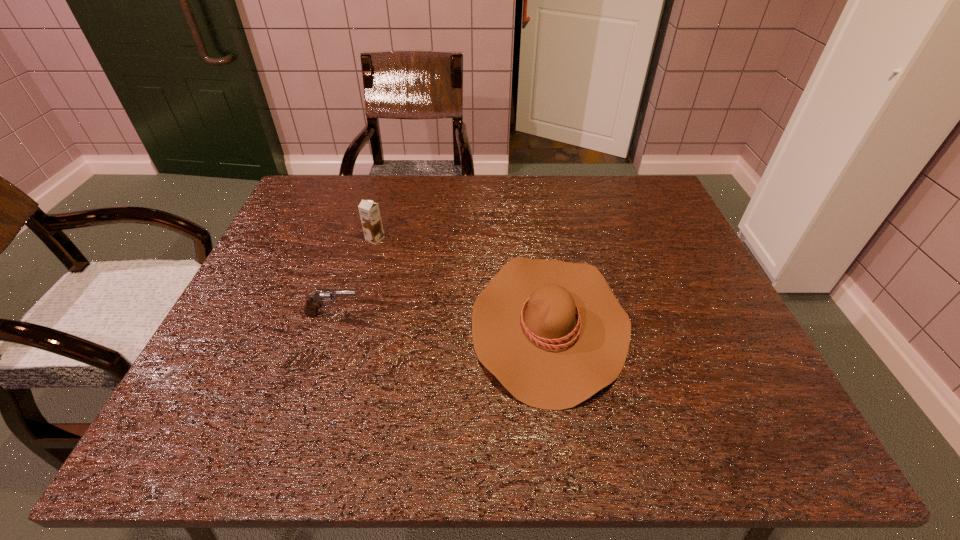
The width and height of the screenshot is (960, 540). Find the location of `vacant point located between the cowboy hat and the farthest object`. vacant point located between the cowboy hat and the farthest object is located at coordinates (462, 281).

This screenshot has height=540, width=960. In order to click on vacant region between the cowboy hat and the pistol in this screenshot , I will do `click(441, 319)`.

This screenshot has width=960, height=540. I want to click on vacant area that lies between the pistol and the cowboy hat, so 441,319.

Identify which object is the second closest to the cowboy hat. Please provide its 2D coordinates. Your answer should be formatted as a tuple, i.e. [(x, y)], where the tuple contains the x and y coordinates of a point satisfying the conditions above.

[(316, 300)]

Identify which object is the closest to the chocolate milk. Please provide its 2D coordinates. Your answer should be formatted as a tuple, i.e. [(x, y)], where the tuple contains the x and y coordinates of a point satisfying the conditions above.

[(316, 300)]

At what (x,y) coordinates should I click in order to perform the action: click on free space that satisfies the following two spatial constraints: 1. on the back side of the cowboy hat; 2. at the barrel of the pistol. Please return your answer as a coordinate pair (x, y). Looking at the image, I should click on (548, 314).

Locate an element on the screen. The width and height of the screenshot is (960, 540). vacant point that satisfies the following two spatial constraints: 1. on the front side of the chocolate milk; 2. on the left side of the rightmost object is located at coordinates (351, 323).

The width and height of the screenshot is (960, 540). In order to click on free space that satisfies the following two spatial constraints: 1. at the barrel of the pistol; 2. on the left side of the cowboy hat in this screenshot , I will do `click(330, 323)`.

Where is `vacant space that satisfies the following two spatial constraints: 1. on the front side of the farthest object; 2. at the barrel of the pistol`? vacant space that satisfies the following two spatial constraints: 1. on the front side of the farthest object; 2. at the barrel of the pistol is located at coordinates (354, 314).

I want to click on vacant position in the image that satisfies the following two spatial constraints: 1. at the barrel of the pistol; 2. on the left side of the rightmost object, so click(330, 323).